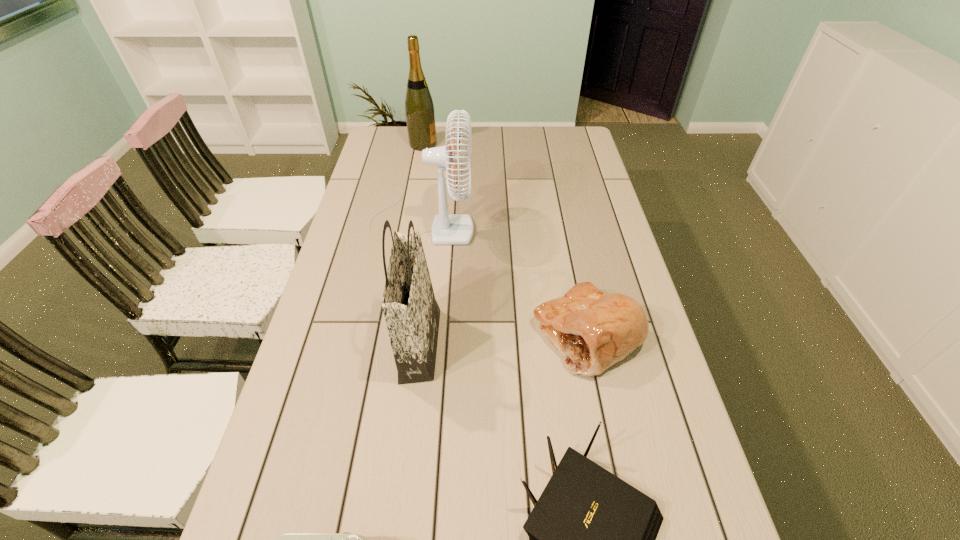
What are the coordinates of `the farthest object` in the screenshot? It's located at (419, 109).

In order to click on fan in this screenshot , I will do `click(447, 229)`.

I want to click on shopping bag, so click(x=412, y=315).

Identify the location of bread. The width and height of the screenshot is (960, 540). (592, 330).

Identify the location of vacant point located on the front-facing side of the farthest object. (519, 145).

I want to click on vacant space situated 0.200m on the front-facing side of the fan, so click(x=534, y=219).

Locate an element on the screen. The height and width of the screenshot is (540, 960). blank space located on the front of the shopping bag with the design is located at coordinates (570, 345).

Identify the location of vacant region located on the filling side of the bread. (491, 336).

The image size is (960, 540). I want to click on free location located 0.150m on the filling side of the bread, so click(x=475, y=336).

At what (x,y) coordinates should I click in order to perform the action: click on free region located on the filling side of the bread. Please return your answer as a coordinate pair (x, y). The image size is (960, 540). Looking at the image, I should click on (391, 336).